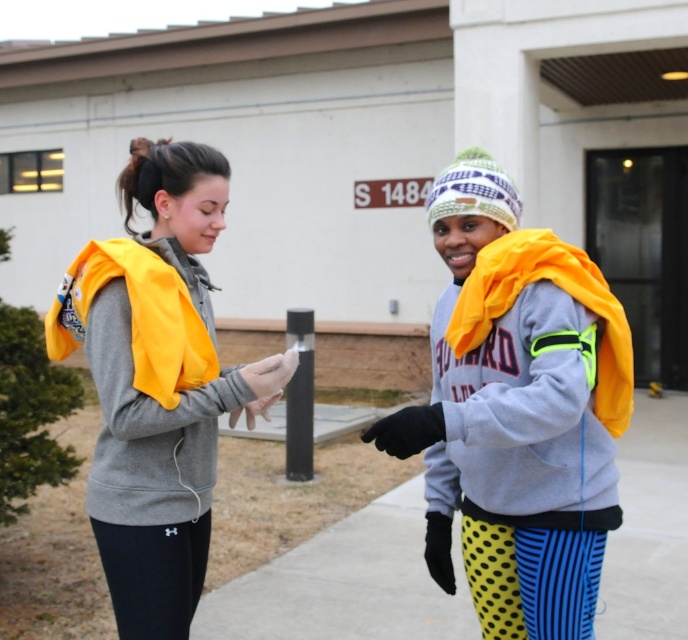
Question: Does gray fleece sweatshirt at right have a smaller size compared to yellow polka dot leggings at lower center?

Choices:
 (A) yes
 (B) no

Answer: (B)

Question: Is yellow knit beanie at center thinner than gray fleece sweatshirt at left?

Choices:
 (A) yes
 (B) no

Answer: (B)

Question: Which of these objects is positioned closest to the matte gray hoodie at center?

Choices:
 (A) black matte leggings at lower left
 (B) smooth concrete pavement at center
 (C) gray fleece sweatshirt at right

Answer: (A)

Question: Which object is positioned farthest from the smooth concrete pavement at center?

Choices:
 (A) gray fleece sweatshirt at right
 (B) yellow polka dot leggings at lower center
 (C) yellow knit beanie at center
 (D) gray fleece sweatshirt at left

Answer: (D)

Question: In this image, where is gray fleece sweatshirt at right located relative to gray fleece sweatshirt at left?

Choices:
 (A) below
 (B) above

Answer: (A)

Question: Which point is farther to the camera?

Choices:
 (A) (114, 449)
 (B) (202, 531)
 (C) (570, 582)

Answer: (B)